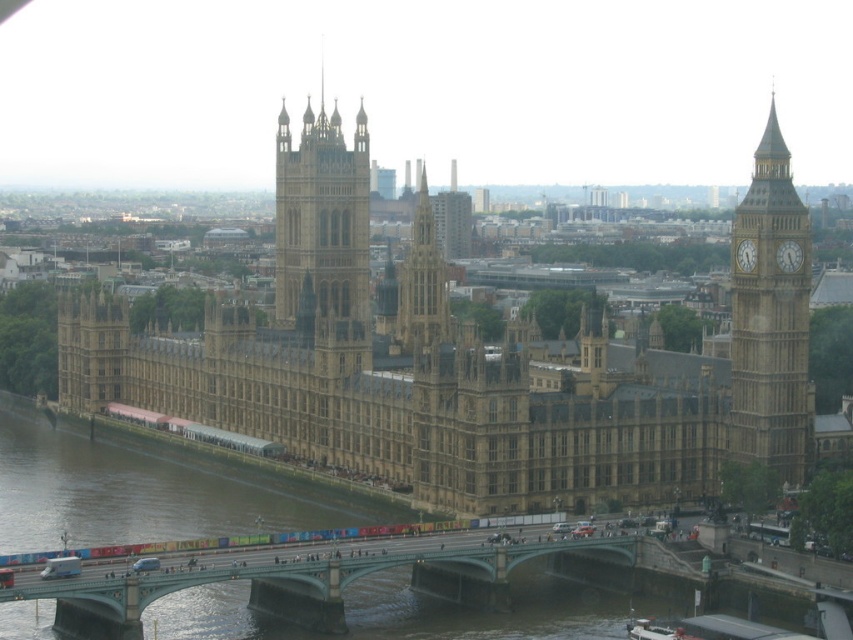
Does golden stone building at center appear on the right side of green painted metal bridge at center?

Incorrect, golden stone building at center is not on the right side of green painted metal bridge at center.

Is point (532, 464) positioned behind point (497, 605)?

Yes, it is behind point (497, 605).

At what (x,y) coordinates should I click in order to perform the action: click on golden stone building at center. Please return your answer as a coordinate pair (x, y). Looking at the image, I should click on (466, 365).

Between golden stone tower at center and golden stone spire at center, which one has less height?

Standing shorter between the two is golden stone spire at center.

Does point (312, 132) come in front of point (434, 289)?

No, it is behind (434, 289).

Does point (343, 269) come behind point (415, 314)?

Yes, it is.

This screenshot has width=853, height=640. I want to click on golden stone tower at center, so click(323, 236).

Between golden stone clock tower at right and gold metallic clock at right, which one has more height?

golden stone clock tower at right

Describe the element at coordinates (770, 321) in the screenshot. I see `golden stone clock tower at right` at that location.

In the scene shown: Who is more forward, (x=769, y=310) or (x=785, y=256)?

Point (x=769, y=310) is in front.

The width and height of the screenshot is (853, 640). Identify the location of golden stone clock tower at right. (770, 321).